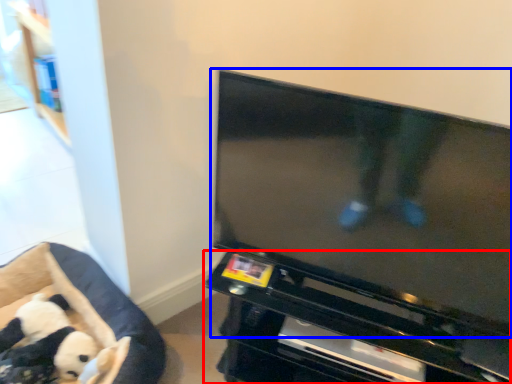
Question: Which of the following is the closest to the observer, entertainment center (highlighted by a red box) or television (highlighted by a blue box)?

Choices:
 (A) entertainment center
 (B) television

Answer: (B)